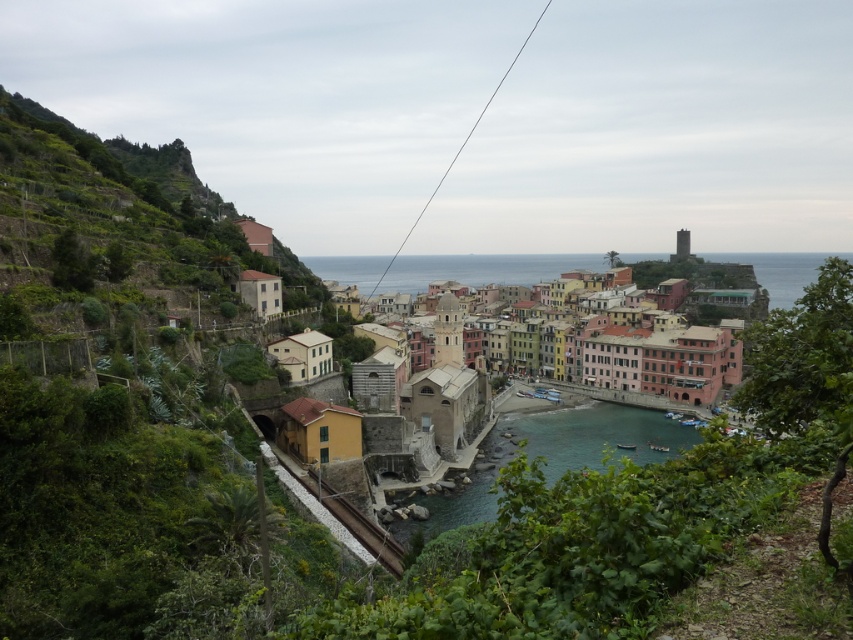
Does point (514, 435) come farther from viewer compared to point (409, 273)?

No, (514, 435) is in front of (409, 273).

Is clear blue water at center bigger than multicolored painted buildings at center?

No, clear blue water at center is not bigger than multicolored painted buildings at center.

In order to click on clear blue water at center in this screenshot , I will do `click(550, 454)`.

What are the coordinates of `clear blue water at center` in the screenshot? It's located at point(550,454).